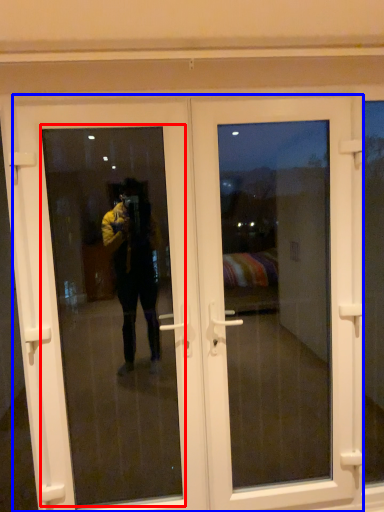
Question: Which object is closer to the camera taking this photo, window screen (highlighted by a red box) or door (highlighted by a blue box)?

Choices:
 (A) window screen
 (B) door

Answer: (A)